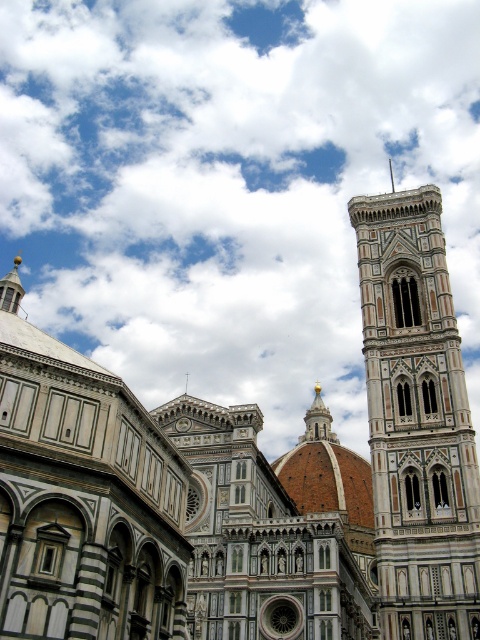
Between white fluffy cloud at upper center and white marble bell tower at right, which one has more height?

Standing taller between the two is white fluffy cloud at upper center.

Measure the distance between white fluffy cloud at upper center and white marble bell tower at right.

A distance of 109.54 meters exists between white fluffy cloud at upper center and white marble bell tower at right.

Is point (250, 278) positioned behind point (419, 593)?

Yes, point (250, 278) is farther from viewer.

Identify the location of white fluffy cloud at upper center. This screenshot has width=480, height=640. (230, 184).